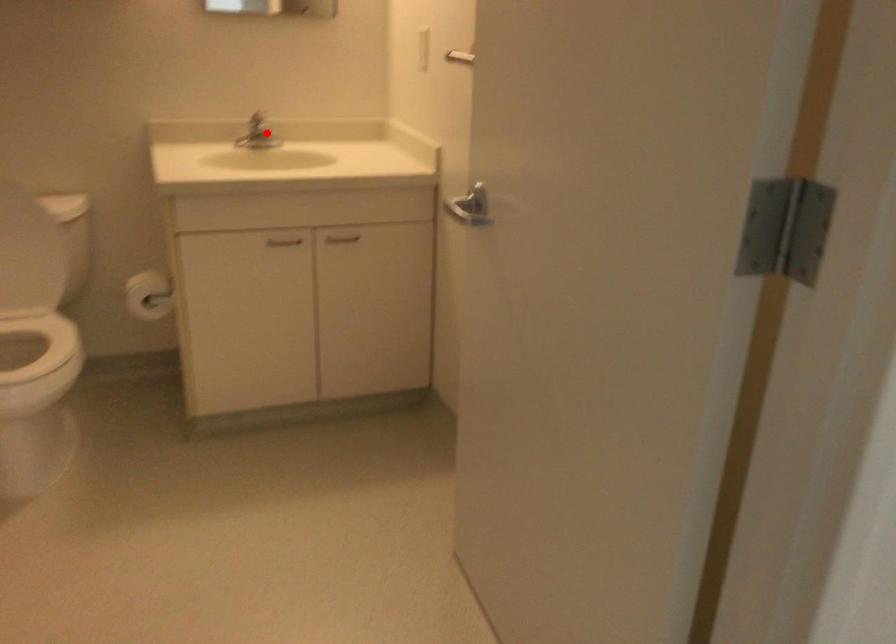
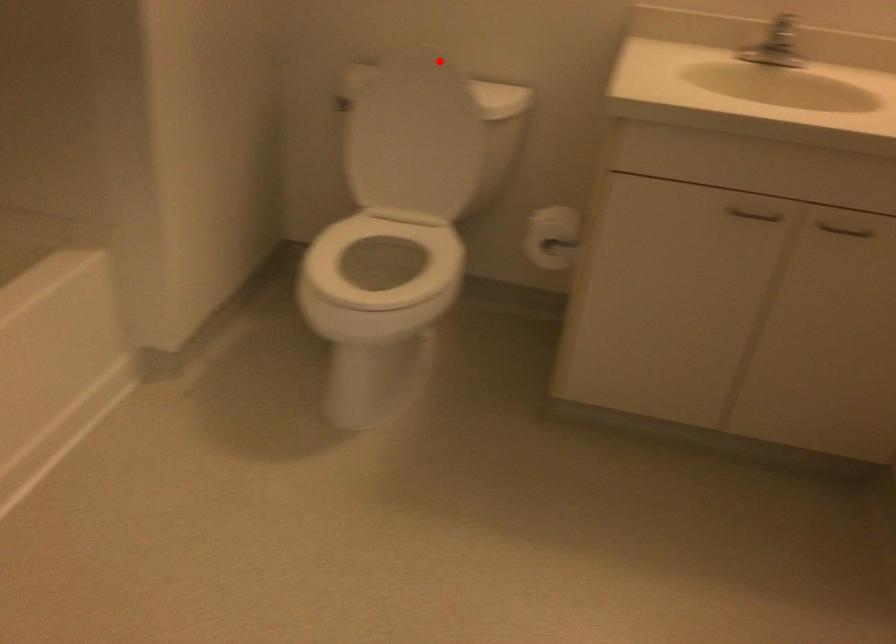
I am providing you with two images of the same scene from different viewpoints. A red point is marked on the first image and another point is marked on the second image. Does the point marked in image1 correspond to the same location as the one in image2?

No